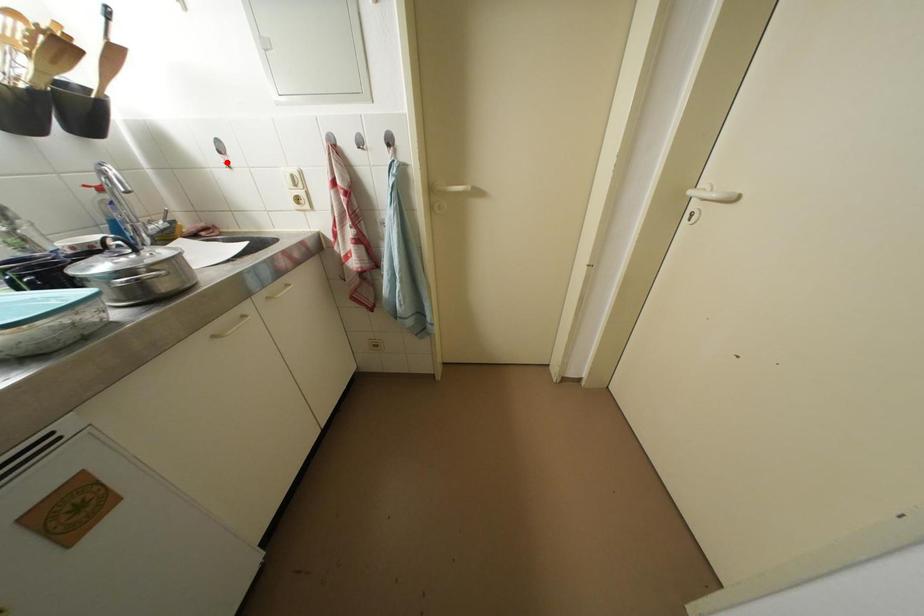
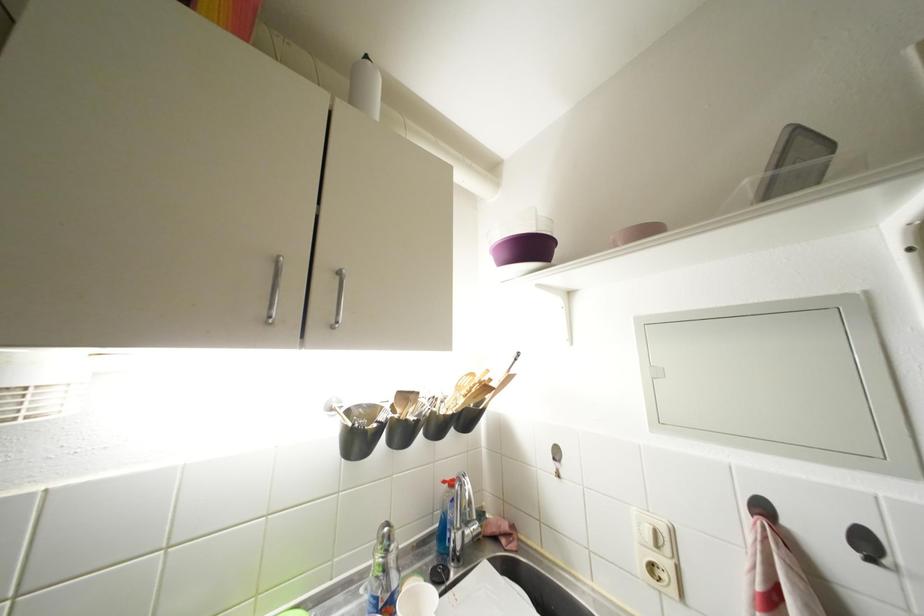
The point at the highlighted location is marked in the first image. Where is the corresponding point in the second image?

(560, 469)